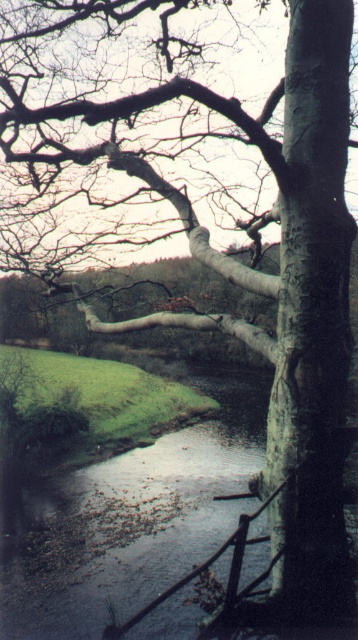
Which is behind, point (342, 236) or point (253, 440)?

The point (253, 440) is behind.

Can you confirm if white smooth tree trunk at right is shorter than smooth gray river at center?

No.

Image resolution: width=358 pixels, height=640 pixels. I want to click on white smooth tree trunk at right, so click(x=312, y=314).

This screenshot has height=640, width=358. What are the coordinates of `white smooth tree trunk at right` in the screenshot? It's located at (312, 314).